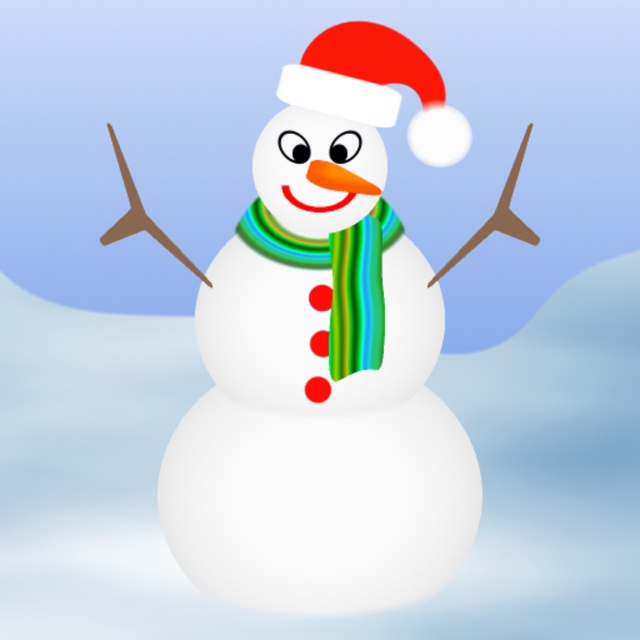
You are standing in front of the snowman in the image. There is a point marked at coordinates [376,86]. What object is located at that point?

The point at coordinates [376,86] indicates the location of the matte red santa hat at upper center.

You are a child who wants to place a new hat on the snowman. The current hat is the matte red santa hat at upper center. Where should you place the new hat relative to the white matte snowman at center?

The matte red santa hat at upper center is currently placed above the white matte snowman at center. To place a new hat in the same position, you should place it above the white matte snowman at center.

Consider the image. What is the exact position of the matte red santa hat at upper center relative to the snowman?

The matte red santa hat at upper center is located at point coordinates of 0.136 on the x axis and 0.589 on the y axis.